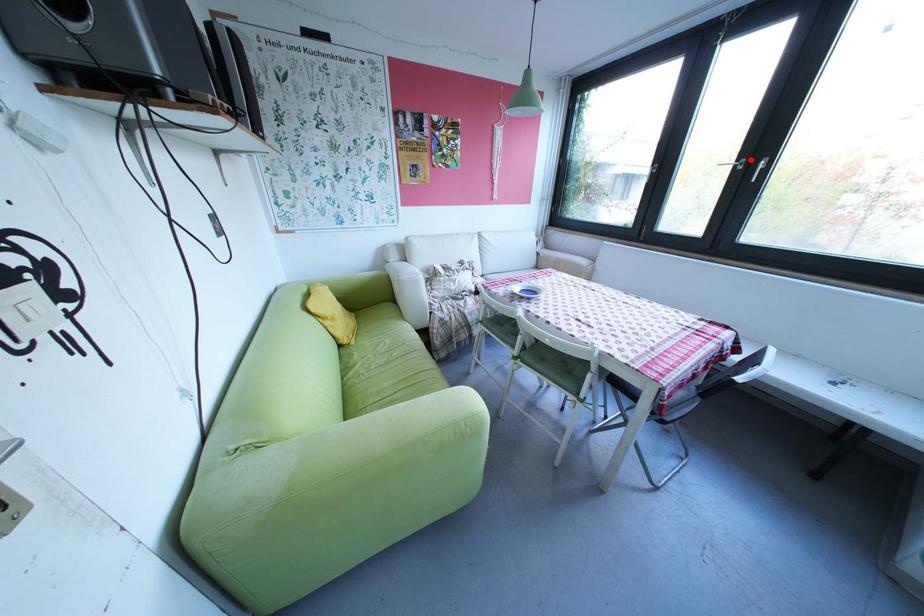
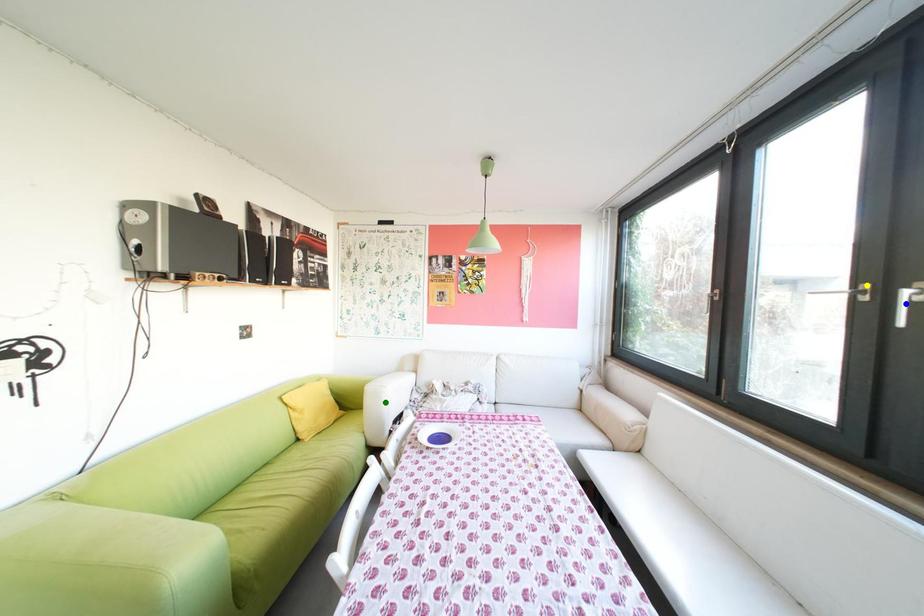
Question: I am providing you with two images of the same scene from different viewpoints. A red point is marked on the first image. You are given multiple points on the second image. Which point in image 2 represents the same 3d spot as the red point in image 1?

Choices:
 (A) blue point
 (B) green point
 (C) yellow point

Answer: (C)